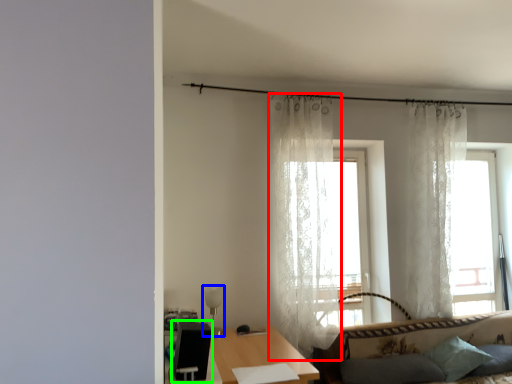
Question: Which object is the farthest from curtain (highlighted by a red box)? Choose among these: lamp (highlighted by a blue box) or swivel chair (highlighted by a green box).

Choices:
 (A) lamp
 (B) swivel chair

Answer: (B)